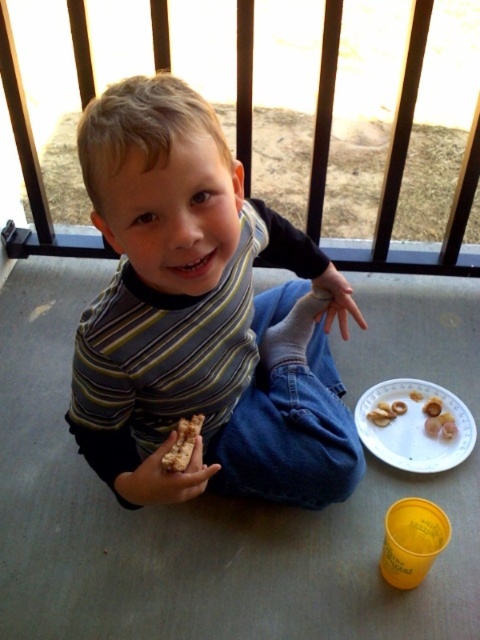
Question: Among these points, which one is farthest from the camera?

Choices:
 (A) (178, 460)
 (B) (136, 467)
 (C) (420, 394)

Answer: (C)

Question: Is white matte crackers at lower right closer to the viewer compared to brown crumbly snack at lower left?

Choices:
 (A) no
 (B) yes

Answer: (A)

Question: Can you confirm if black metal rail at upper center is smaller than white paper plate at lower right?

Choices:
 (A) yes
 (B) no

Answer: (B)

Question: Does striped fabric shirt at center appear under white matte crackers at lower right?

Choices:
 (A) yes
 (B) no

Answer: (B)

Question: Which point is closer to the camera taking this photo?

Choices:
 (A) (x=363, y=436)
 (B) (x=195, y=488)

Answer: (B)

Question: Which object appears farthest from the camera in this image?

Choices:
 (A) brown crumbly snack at lower left
 (B) white matte crackers at lower right
 (C) brown crumbly cookie at center
 (D) black metal rail at upper center

Answer: (B)